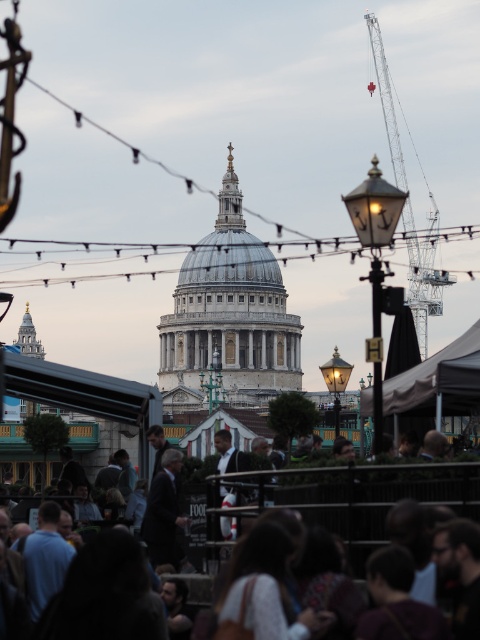
You are a photographer trying to capture a photo of the dark suit at center without including the metallic gray crane at upper right in the frame. Given their widths, is this possible?

The metallic gray crane at upper right is wider than the dark suit at center. Since the crane is wider, it might be challenging to frame the photo so that only the dark suit at center is visible without the crane appearing in the shot.

You are standing at the point with coordinates point (162, 509) and want to walk towards the cathedral. Is the point point (248, 508) blocking your path?

Point (248, 508) is in front of point (162, 509), so yes, the point point (248, 508) is blocking your path.

You are a tourist standing in front of St. Paul Cathedral and you see the metallic gray crane at upper right and the dark suit at center. Which object is closer to you?

The metallic gray crane at upper right is closer to you than the dark suit at center because it is further to the viewer.